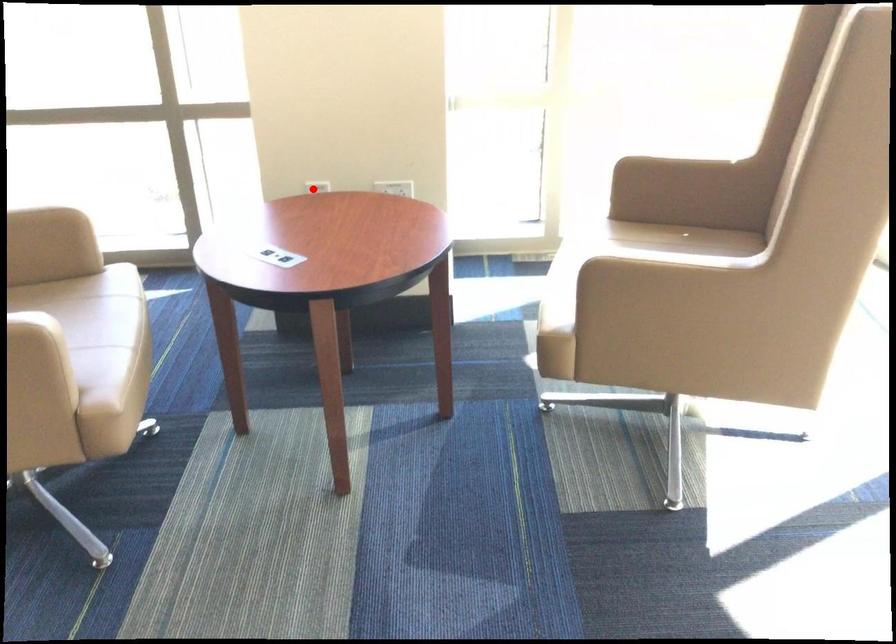
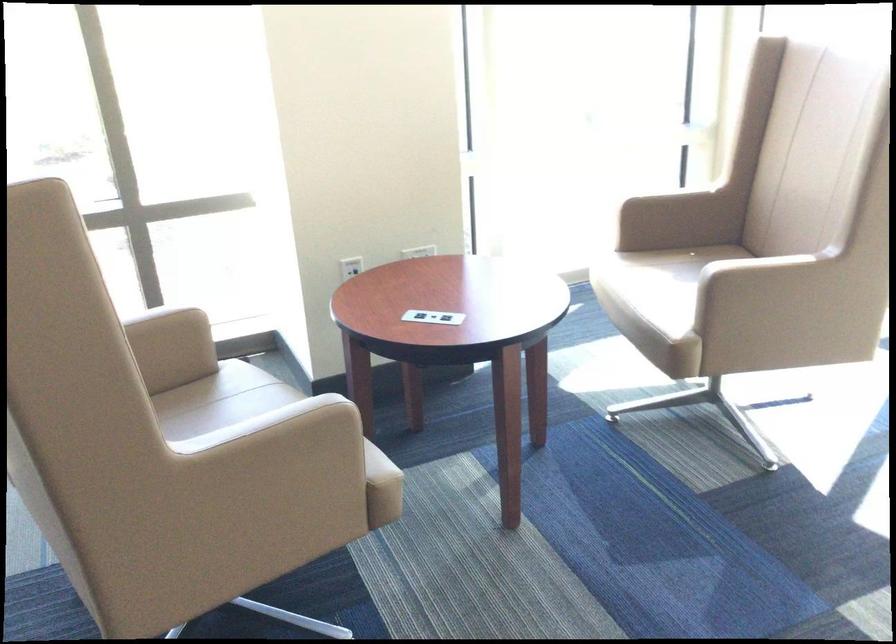
Locate, in the second image, the point that corresponds to the highlighted location in the first image.

(350, 267)